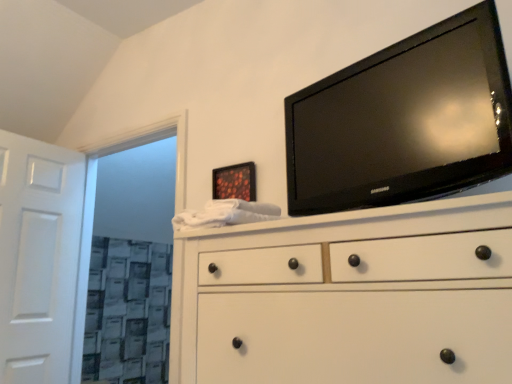
Question: From the image's perspective, would you say white wooden door at left is positioned over white matte chest of drawers at center?

Choices:
 (A) yes
 (B) no

Answer: (B)

Question: Is white wooden door at left at the right side of white matte chest of drawers at center?

Choices:
 (A) yes
 (B) no

Answer: (B)

Question: Is white matte chest of drawers at center at the back of white wooden door at left?

Choices:
 (A) yes
 (B) no

Answer: (B)

Question: From a real-world perspective, is white wooden door at left under white matte chest of drawers at center?

Choices:
 (A) no
 (B) yes

Answer: (A)

Question: Can you confirm if white wooden door at left is wider than white matte chest of drawers at center?

Choices:
 (A) yes
 (B) no

Answer: (B)

Question: Which is correct: white matte chest of drawers at center is inside white wooden door at left, or outside of it?

Choices:
 (A) inside
 (B) outside

Answer: (B)

Question: Is white matte chest of drawers at center in front of or behind white wooden door at left in the image?

Choices:
 (A) front
 (B) behind

Answer: (A)

Question: From a real-world perspective, is white matte chest of drawers at center positioned above or below white wooden door at left?

Choices:
 (A) above
 (B) below

Answer: (B)

Question: Is white matte chest of drawers at center taller or shorter than white wooden door at left?

Choices:
 (A) short
 (B) tall

Answer: (A)

Question: Is point (391, 140) positioned closer to the camera than point (133, 140)?

Choices:
 (A) farther
 (B) closer

Answer: (B)

Question: Relative to white textured glass door at left, is black glossy tv at upper right in front or behind?

Choices:
 (A) behind
 (B) front

Answer: (B)

Question: From the image's perspective, is black glossy tv at upper right located above or below white textured glass door at left?

Choices:
 (A) below
 (B) above

Answer: (B)

Question: Is black glossy tv at upper right taller or shorter than white textured glass door at left?

Choices:
 (A) short
 (B) tall

Answer: (A)

Question: Is white wooden door at left inside or outside of white matte chest of drawers at center?

Choices:
 (A) inside
 (B) outside

Answer: (B)

Question: Considering the positions of white wooden door at left and white matte chest of drawers at center in the image, is white wooden door at left bigger or smaller than white matte chest of drawers at center?

Choices:
 (A) big
 (B) small

Answer: (B)